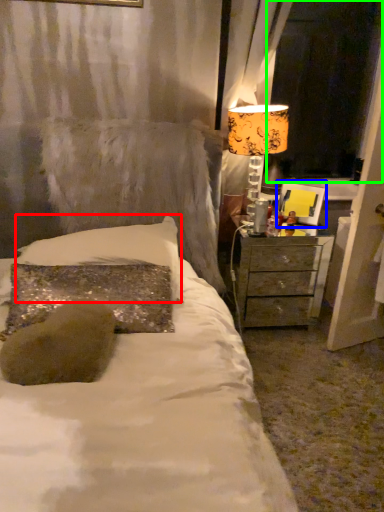
Question: Which object is the farthest from pillow (highlighted by a red box)? Choose among these: picture frame (highlighted by a blue box) or window screen (highlighted by a green box).

Choices:
 (A) picture frame
 (B) window screen

Answer: (B)